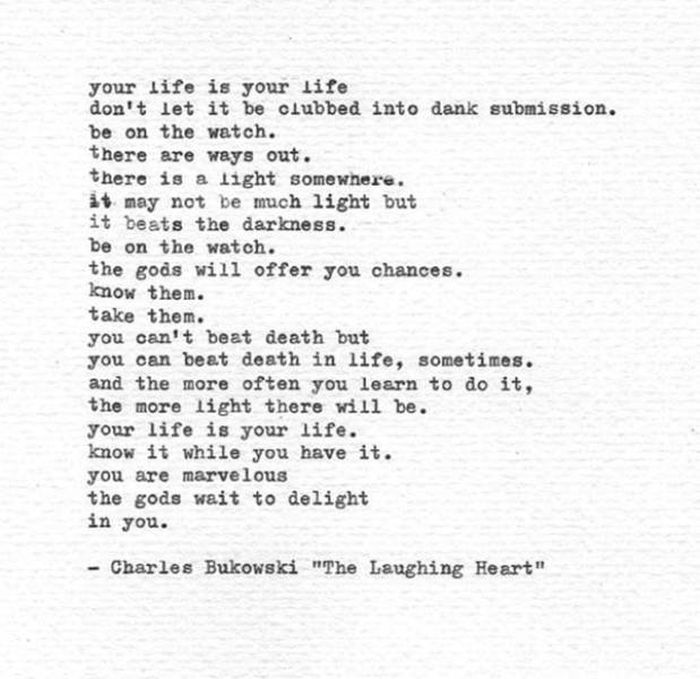
Locate an element on the screen. light is located at coordinates (351, 201), (225, 411).